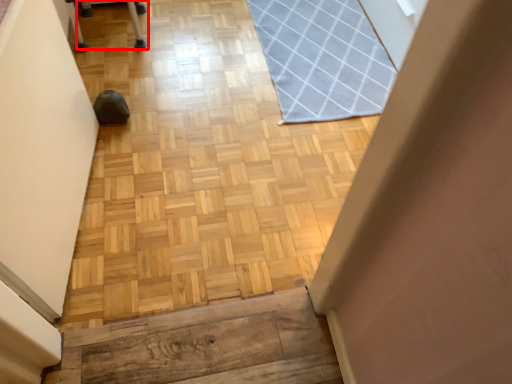
Question: Where is furniture (annotated by the red box) located in relation to mat in the image?

Choices:
 (A) left
 (B) right

Answer: (A)